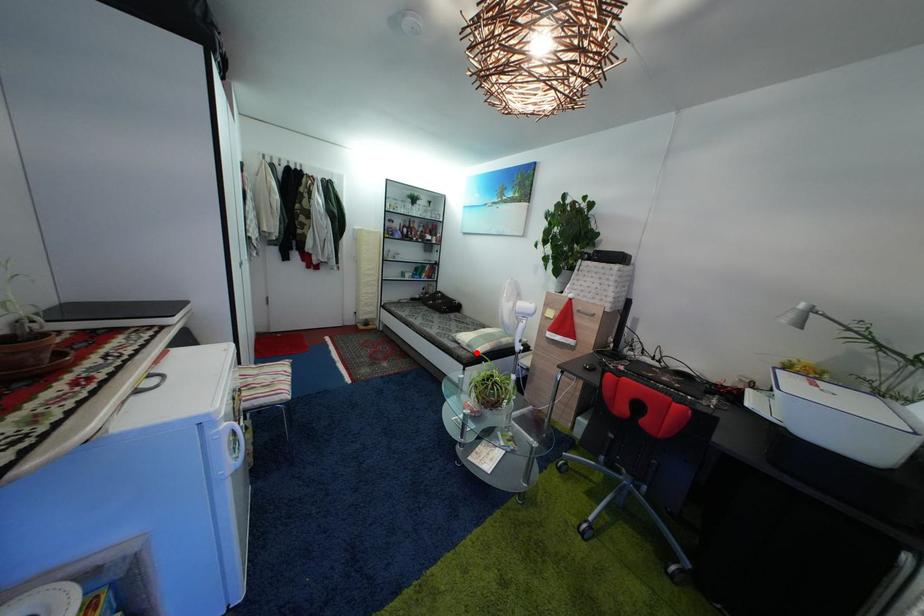
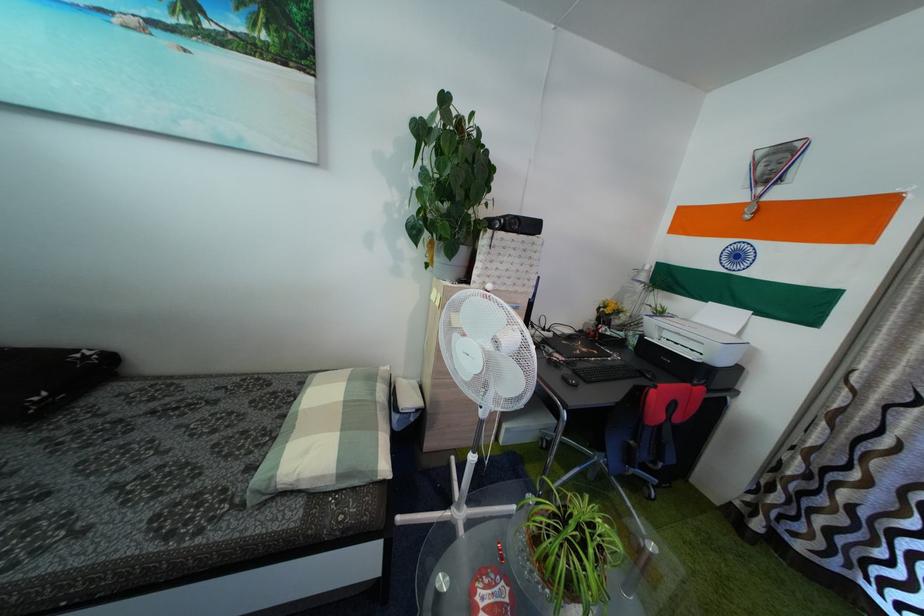
Find the pixel in the second image that matches the highlighted location in the first image.

(347, 483)